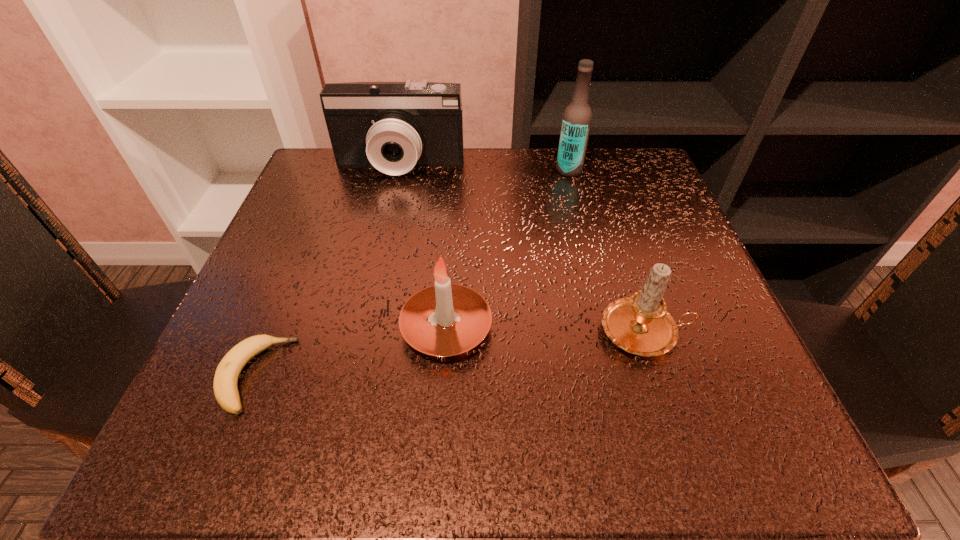
The image size is (960, 540). Find the location of `the tallest object`. the tallest object is located at coordinates (577, 118).

Locate an element on the screen. The width and height of the screenshot is (960, 540). camcorder is located at coordinates (392, 126).

At what (x,y) coordinates should I click in order to perform the action: click on the left candle. Please return your answer as a coordinate pair (x, y). Looking at the image, I should click on [x=443, y=320].

I want to click on the right candle, so click(640, 324).

This screenshot has width=960, height=540. I want to click on banana, so click(x=225, y=387).

Find the location of `free space located 0.080m on the side of the tallest object with the label`. free space located 0.080m on the side of the tallest object with the label is located at coordinates (520, 170).

Where is `free region located 0.180m on the side of the tallest object with the label`? Image resolution: width=960 pixels, height=540 pixels. free region located 0.180m on the side of the tallest object with the label is located at coordinates (475, 170).

Identify the location of vacant space situated on the side of the tallest object with the label. (534, 170).

The width and height of the screenshot is (960, 540). I want to click on vacant space located 0.050m on the lens of the second tallest object, so click(394, 197).

Where is `blank area located 0.200m on the back of the left candle`? This screenshot has height=540, width=960. blank area located 0.200m on the back of the left candle is located at coordinates (454, 219).